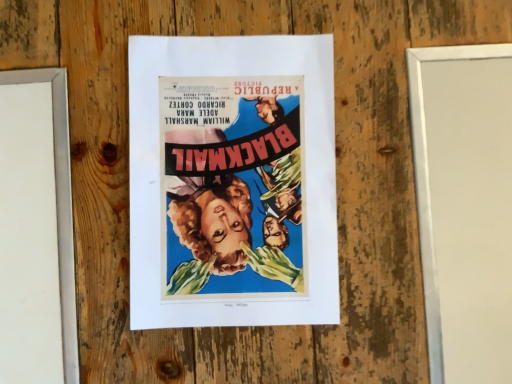
Where is `vibrant paper poster at center`? This screenshot has height=384, width=512. vibrant paper poster at center is located at coordinates pos(232,181).

What do you see at coordinates (232, 181) in the screenshot?
I see `vibrant paper poster at center` at bounding box center [232, 181].

Locate an element on the screen. The height and width of the screenshot is (384, 512). vibrant paper poster at center is located at coordinates (232, 181).